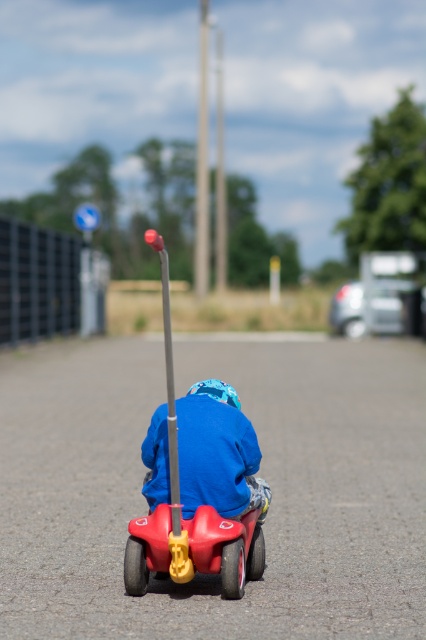
Question: Can you confirm if rubberized plastic toy car at center is positioned above blue matte jacket at center?

Choices:
 (A) yes
 (B) no

Answer: (A)

Question: Which point is farther from the camera taking this photo?

Choices:
 (A) (235, 506)
 (B) (198, 436)

Answer: (A)

Question: Is rubberized plastic toy car at center to the right of blue matte jacket at center from the viewer's perspective?

Choices:
 (A) no
 (B) yes

Answer: (A)

Question: In this image, where is rubberized plastic toy car at center located relative to blue matte jacket at center?

Choices:
 (A) above
 (B) below

Answer: (A)